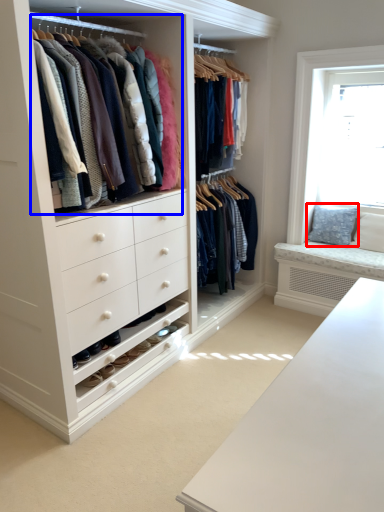
Question: Among these objects, which one is nearest to the camera, pillow (highlighted by a red box) or closet (highlighted by a blue box)?

Choices:
 (A) pillow
 (B) closet

Answer: (B)